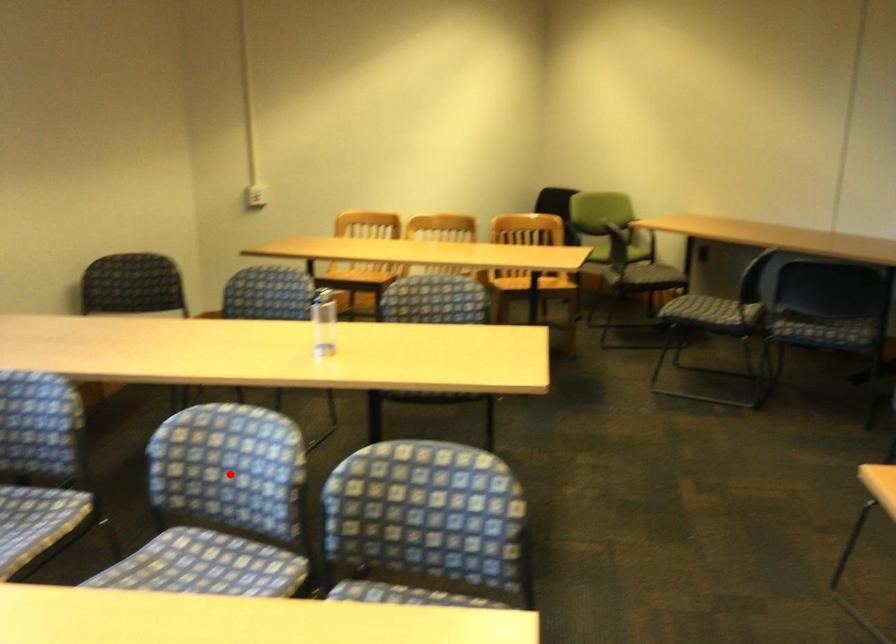
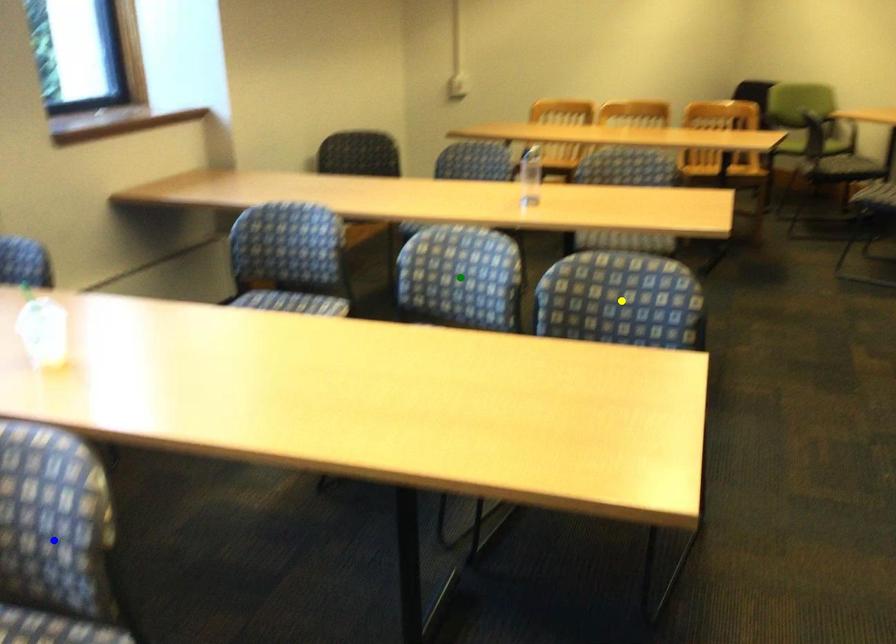
Question: I am providing you with two images of the same scene from different viewpoints. A red point is marked on the first image. You are given multiple points on the second image. Which point in image 2 is actually the same real-world point as the red point in image 1?

Choices:
 (A) green point
 (B) blue point
 (C) yellow point

Answer: (A)